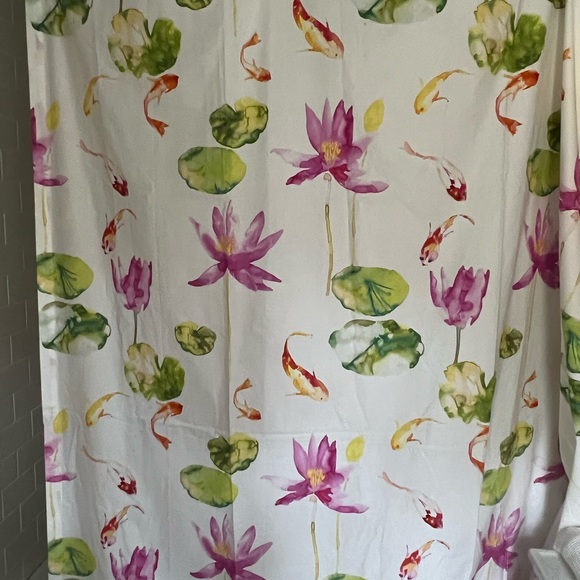
Locate an element on the screen. The height and width of the screenshot is (580, 580). tile wall is located at coordinates (9, 377).